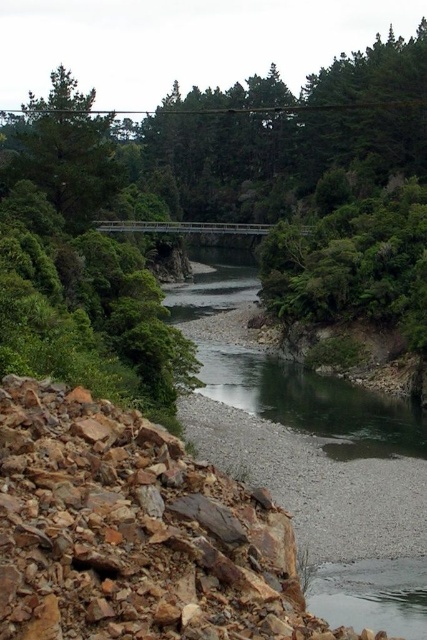
Question: In this image, where is green leafy tree at center located relative to green matte tree at upper left?

Choices:
 (A) left
 (B) right

Answer: (B)

Question: Is green leafy tree at center above green matte tree at upper left?

Choices:
 (A) yes
 (B) no

Answer: (B)

Question: Which object appears farthest from the camera in this image?

Choices:
 (A) gray gravel stream at center
 (B) green leafy tree at center
 (C) green matte tree at upper left

Answer: (B)

Question: Which object is closer to the camera taking this photo?

Choices:
 (A) green matte tree at upper left
 (B) green leafy tree at center

Answer: (A)

Question: Does green leafy tree at center appear on the left side of green matte tree at upper left?

Choices:
 (A) yes
 (B) no

Answer: (B)

Question: Which point is closer to the camera?

Choices:
 (A) (315, 260)
 (B) (84, 99)

Answer: (B)